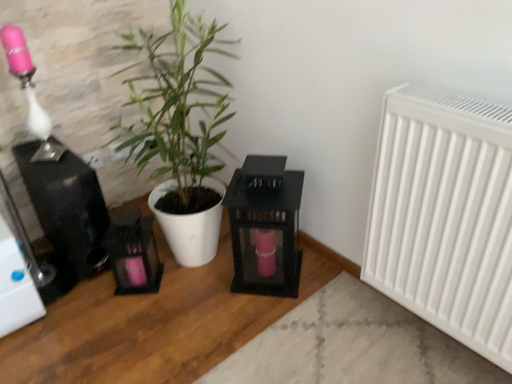
Question: Considering the positions of point pos(173,180) and point pos(35,132), is point pos(173,180) closer or farther from the camera than point pos(35,132)?

Choices:
 (A) farther
 (B) closer

Answer: (A)

Question: Considering their positions, is white matte plant pot at center located in front of or behind matte pink glass at upper left?

Choices:
 (A) front
 (B) behind

Answer: (A)

Question: Considering the real-world distances, which object is closest to the white matte plant pot at center?

Choices:
 (A) matte pink glass at upper left
 (B) black glass lantern at center
 (C) white matte radiator at right

Answer: (B)

Question: Based on their relative distances, which object is farther from the white matte radiator at right?

Choices:
 (A) black glass lantern at center
 (B) white matte plant pot at center
 (C) matte pink glass at upper left

Answer: (C)